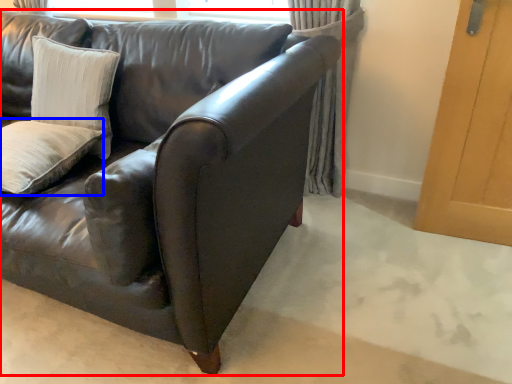
Question: Which object appears farthest to the camera in this image, studio couch (highlighted by a red box) or pillow (highlighted by a blue box)?

Choices:
 (A) studio couch
 (B) pillow

Answer: (B)